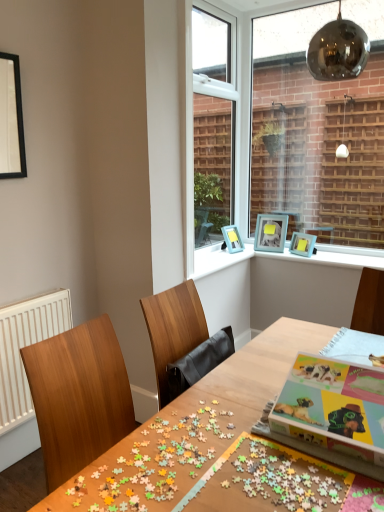
Question: Is white plastic window frame at upper center closer to the viewer compared to wooden table at center?

Choices:
 (A) no
 (B) yes

Answer: (A)

Question: Is white plastic window frame at upper center further to the viewer compared to wooden table at center?

Choices:
 (A) no
 (B) yes

Answer: (B)

Question: From the image's perspective, is white plastic window frame at upper center below wooden table at center?

Choices:
 (A) no
 (B) yes

Answer: (A)

Question: Can you confirm if white plastic window frame at upper center is taller than wooden table at center?

Choices:
 (A) no
 (B) yes

Answer: (B)

Question: Is white plastic window frame at upper center outside wooden table at center?

Choices:
 (A) no
 (B) yes

Answer: (B)

Question: Considering the relative sizes of white plastic window frame at upper center and wooden table at center in the image provided, is white plastic window frame at upper center bigger than wooden table at center?

Choices:
 (A) yes
 (B) no

Answer: (B)

Question: From a real-world perspective, is multicolored cardboard jigsaw puzzle at center under white radiator at left?

Choices:
 (A) no
 (B) yes

Answer: (A)

Question: Considering the relative positions of multicolored cardboard jigsaw puzzle at center and white radiator at left in the image provided, is multicolored cardboard jigsaw puzzle at center behind white radiator at left?

Choices:
 (A) no
 (B) yes

Answer: (A)

Question: Considering the relative positions of multicolored cardboard jigsaw puzzle at center and white radiator at left in the image provided, is multicolored cardboard jigsaw puzzle at center to the right of white radiator at left from the viewer's perspective?

Choices:
 (A) yes
 (B) no

Answer: (A)

Question: Can you confirm if multicolored cardboard jigsaw puzzle at center is wider than white radiator at left?

Choices:
 (A) no
 (B) yes

Answer: (B)

Question: From a real-world perspective, is multicolored cardboard jigsaw puzzle at center positioned over white radiator at left based on gravity?

Choices:
 (A) no
 (B) yes

Answer: (B)

Question: Considering the relative positions of multicolored cardboard jigsaw puzzle at center and white radiator at left in the image provided, is multicolored cardboard jigsaw puzzle at center to the left of white radiator at left from the viewer's perspective?

Choices:
 (A) yes
 (B) no

Answer: (B)

Question: Can you confirm if blue plastic picture frames at upper center is taller than white radiator at left?

Choices:
 (A) yes
 (B) no

Answer: (B)